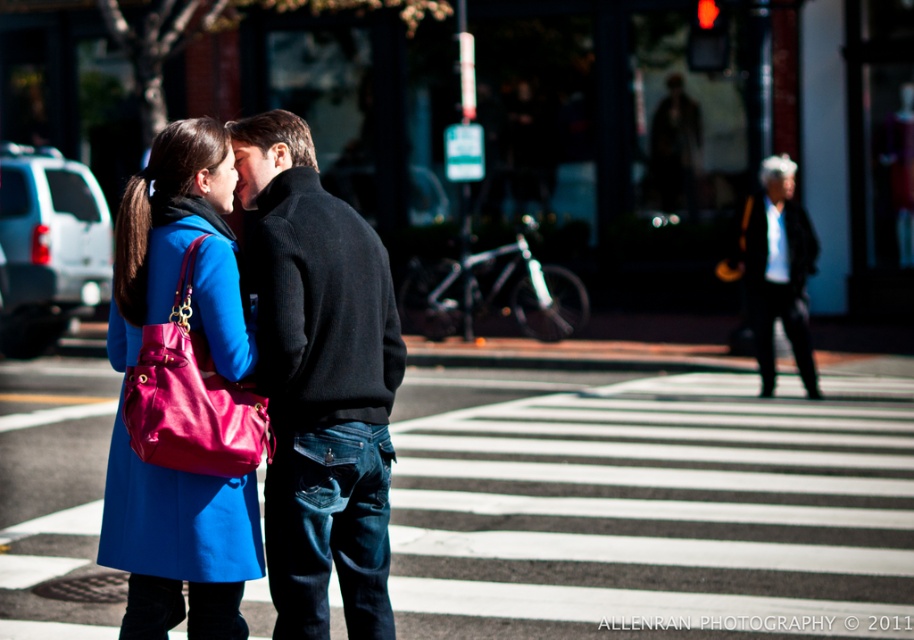
Between matte blue coat at center and black wool coat at center, which one is positioned lower?

matte blue coat at center is below.

You are a GUI agent. You are given a task and a screenshot of the screen. Output one action in this format:
    pyautogui.click(x=<x>, y=<y>)
    Task: Click on the matte blue coat at center
    This screenshot has height=640, width=914.
    Given the screenshot: What is the action you would take?
    pyautogui.click(x=181, y=248)

Measure the distance between matte blue coat at center and camera.

They are 5.63 meters apart.

At what (x,y) coordinates should I click in order to perform the action: click on matte blue coat at center. Please return your answer as a coordinate pair (x, y). This screenshot has width=914, height=640. Looking at the image, I should click on pos(181,248).

Does white shirt at center lie in front of black wool coat at upper right?

Yes.

Is white shirt at center wider than black wool coat at upper right?

No, white shirt at center is not wider than black wool coat at upper right.

The image size is (914, 640). What do you see at coordinates (777, 269) in the screenshot?
I see `white shirt at center` at bounding box center [777, 269].

This screenshot has height=640, width=914. I want to click on white shirt at center, so click(777, 269).

Measure the distance from black wool coat at center to white shirt at center.

33.16 feet

Between point (317, 413) and point (804, 362), which one is positioned in front?

Positioned in front is point (317, 413).

Who is more forward, (275, 180) or (773, 218)?

Point (275, 180)

The width and height of the screenshot is (914, 640). Identify the location of black wool coat at center. (320, 307).